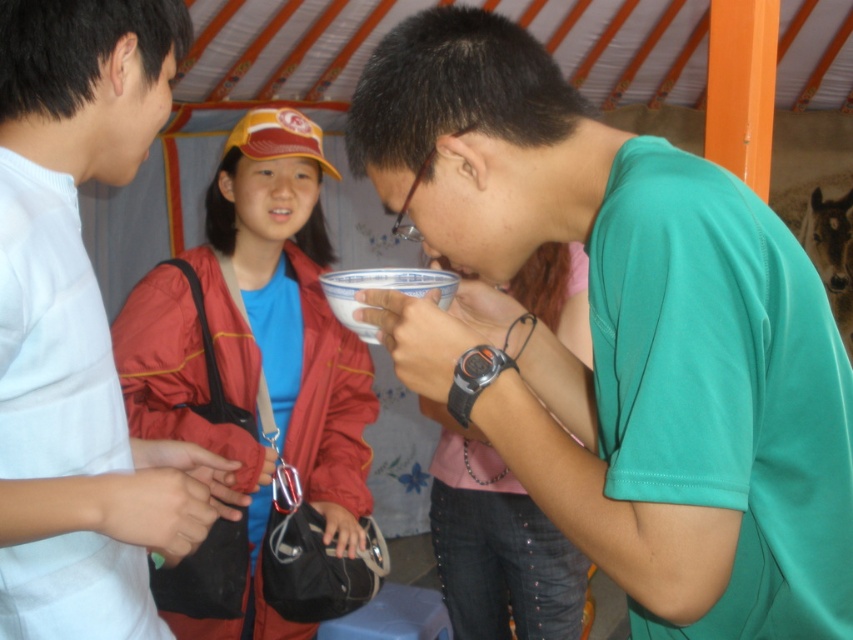
Question: Is matte green t-shirt at center to the right of matte red jacket at center from the viewer's perspective?

Choices:
 (A) yes
 (B) no

Answer: (A)

Question: Which point is farther to the camera?

Choices:
 (A) (281, 413)
 (B) (596, 353)

Answer: (A)

Question: Is matte green t-shirt at center positioned before matte red jacket at center?

Choices:
 (A) no
 (B) yes

Answer: (B)

Question: Is matte green t-shirt at center below matte red jacket at center?

Choices:
 (A) yes
 (B) no

Answer: (B)

Question: Which object is closer to the camera taking this photo?

Choices:
 (A) matte green t-shirt at center
 (B) matte red jacket at center

Answer: (A)